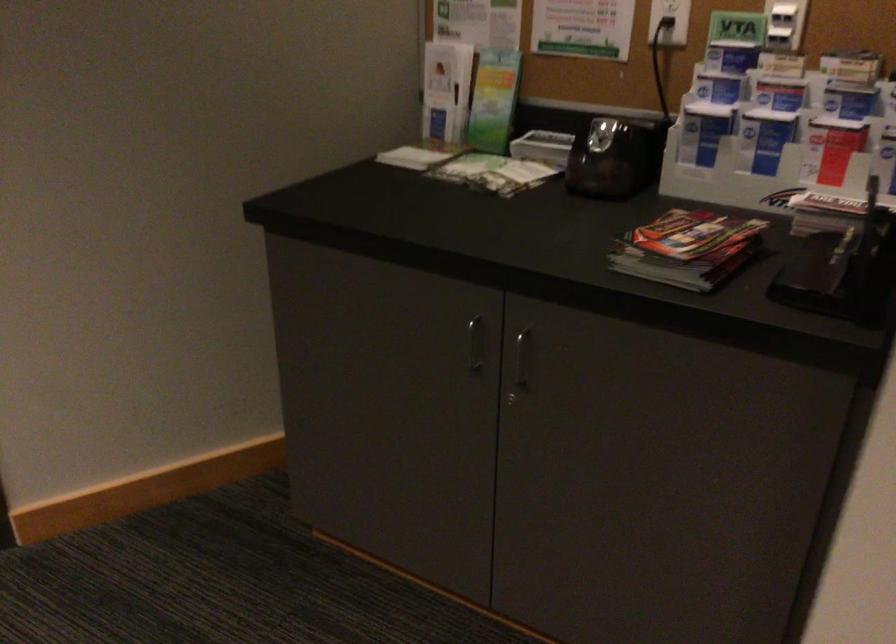
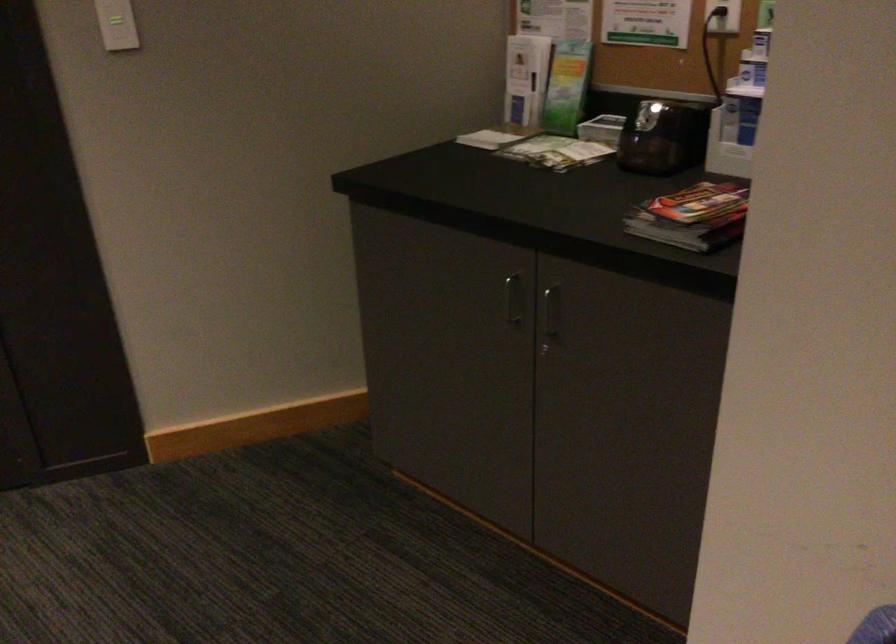
Question: The images are taken continuously from a first-person perspective. In which direction is your viewpoint rotating?

Choices:
 (A) Left
 (B) Right
 (C) Up
 (D) Down

Answer: (A)